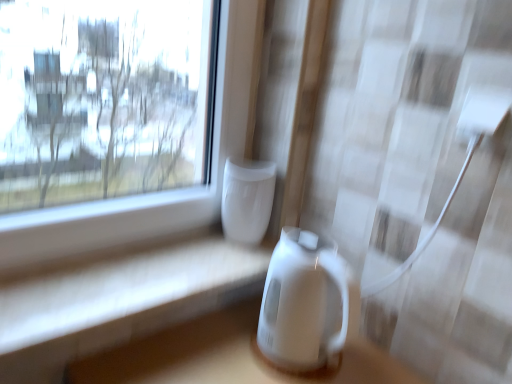
Question: From the image's perspective, is white glossy table at lower center located above or below white glossy electric kettle at center, positioned as the 1th appliance in bottom-to-top order?

Choices:
 (A) below
 (B) above

Answer: (B)

Question: Would you say white glossy table at lower center is inside or outside white glossy electric kettle at center, positioned as the 1th appliance in bottom-to-top order?

Choices:
 (A) outside
 (B) inside

Answer: (A)

Question: Considering the real-world distances, which object is closest to the white glossy electric kettle at center, the second appliance positioned from the top?

Choices:
 (A) white glossy vase at center, placed as the 1th appliance when sorted from top to bottom
 (B) white glossy table at lower center

Answer: (A)

Question: Based on their relative distances, which object is farther from the white glossy vase at center, placed as the 1th appliance when sorted from top to bottom?

Choices:
 (A) white glossy electric kettle at center, positioned as the 1th appliance in bottom-to-top order
 (B) white glossy table at lower center

Answer: (B)